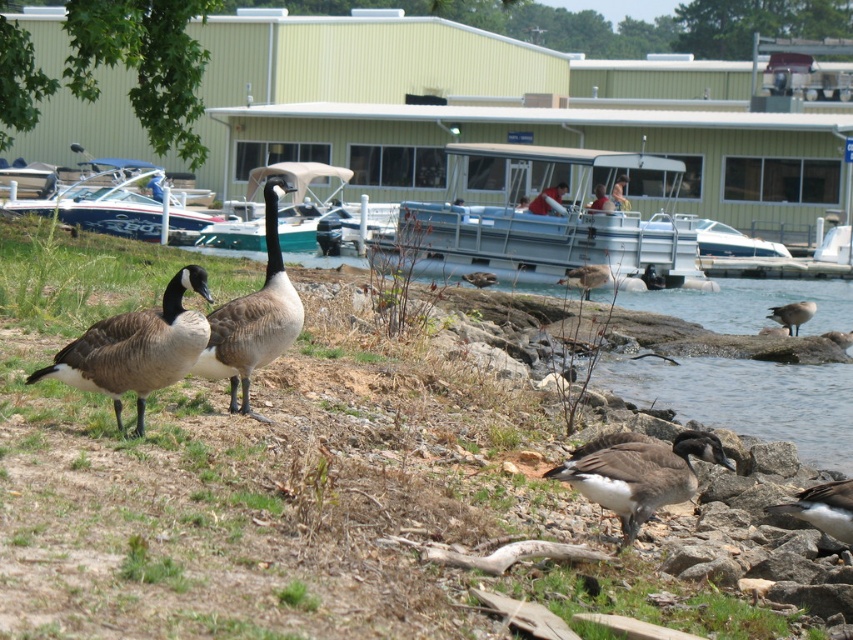
Consider the image. You are standing at the edge of the lakeshore and see the green grass at lower left and the smooth leather jacket at center. Which object is nearer to you?

The green grass at lower left is closer to the viewer than the smooth leather jacket at center.

You are a photographer standing at the edge of the lakeside, and you want to take a photo of the blue glossy boat at center. Where should you position yourself to capture the boat in the best possible view?

The blue glossy boat at center is located at coordinates point (106, 198), so positioning yourself directly in front of that point would provide the best view for capturing the boat.

Consider the image. You are a wildlife photographer aiming to capture a closeup shot of the brown matte duck at lower right and the dark brown feathers at lower right. Since you want to focus on the larger subject, which one should you zoom in on?

The brown matte duck at lower right is bigger than the dark brown feathers at lower right, so you should zoom in on the brown matte duck at lower right for the closeup shot.